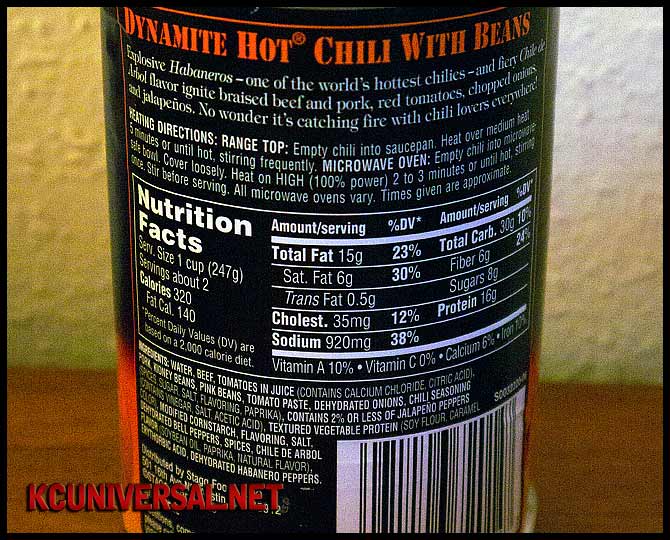
Find the location of a particular element. This screenshot has height=540, width=670. white wall is located at coordinates (597, 245).